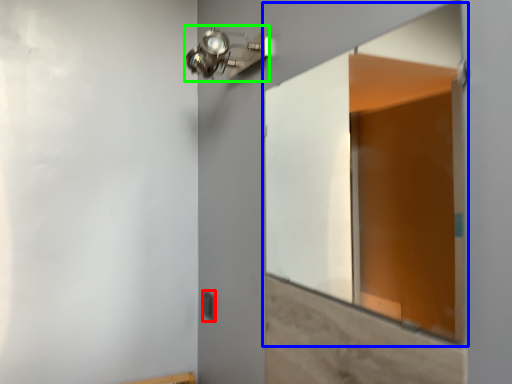
Question: Which object is the farthest from light switch (highlighted by a red box)? Choose among these: window (highlighted by a blue box) or light fixture (highlighted by a green box).

Choices:
 (A) window
 (B) light fixture

Answer: (A)